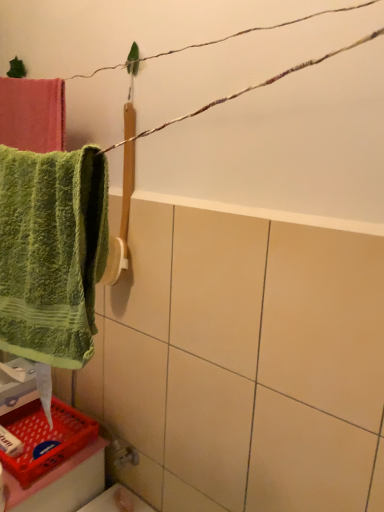
Question: Can we say green textured towel at left lies outside red plastic basket at lower left?

Choices:
 (A) yes
 (B) no

Answer: (A)

Question: Does green textured towel at left appear on the right side of red plastic basket at lower left?

Choices:
 (A) no
 (B) yes

Answer: (B)

Question: Is red plastic basket at lower left surrounded by green textured towel at left?

Choices:
 (A) yes
 (B) no

Answer: (B)

Question: Is green textured towel at left closer to camera compared to red plastic basket at lower left?

Choices:
 (A) yes
 (B) no

Answer: (A)

Question: Is green textured towel at left smaller than red plastic basket at lower left?

Choices:
 (A) yes
 (B) no

Answer: (B)

Question: Are green textured towel at left and red plastic basket at lower left making contact?

Choices:
 (A) yes
 (B) no

Answer: (B)

Question: Can you see red plastic basket at lower left touching white matte soap at lower left?

Choices:
 (A) yes
 (B) no

Answer: (A)

Question: From a real-world perspective, is red plastic basket at lower left positioned over white matte soap at lower left based on gravity?

Choices:
 (A) yes
 (B) no

Answer: (B)

Question: Can you confirm if red plastic basket at lower left is wider than white matte soap at lower left?

Choices:
 (A) yes
 (B) no

Answer: (A)

Question: Considering the relative sizes of red plastic basket at lower left and white matte soap at lower left in the image provided, is red plastic basket at lower left smaller than white matte soap at lower left?

Choices:
 (A) yes
 (B) no

Answer: (B)

Question: Does red plastic basket at lower left appear on the right side of white matte soap at lower left?

Choices:
 (A) yes
 (B) no

Answer: (A)

Question: From the image's perspective, is red plastic basket at lower left on white matte soap at lower left?

Choices:
 (A) yes
 (B) no

Answer: (B)

Question: Does white matte soap at lower left turn towards green textured towel at left?

Choices:
 (A) no
 (B) yes

Answer: (A)